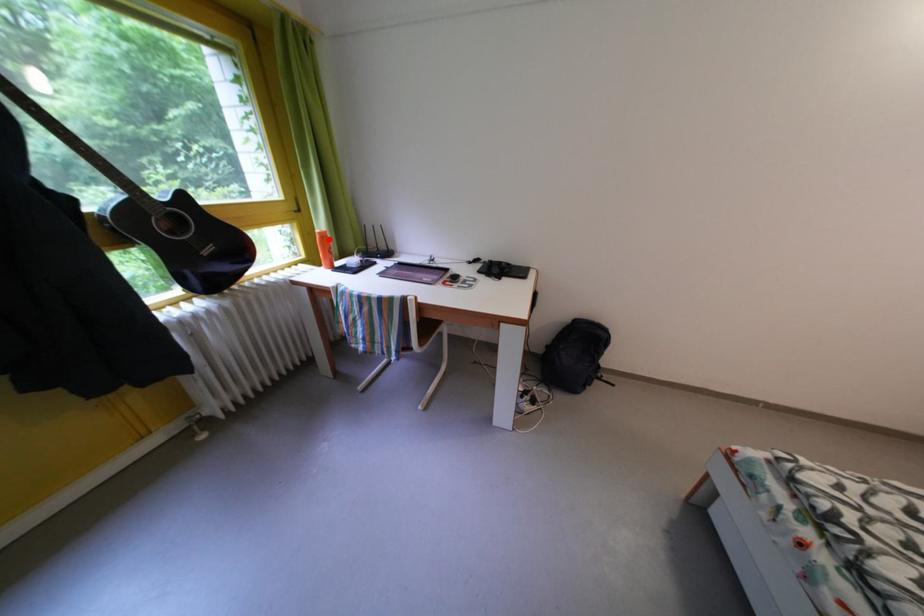
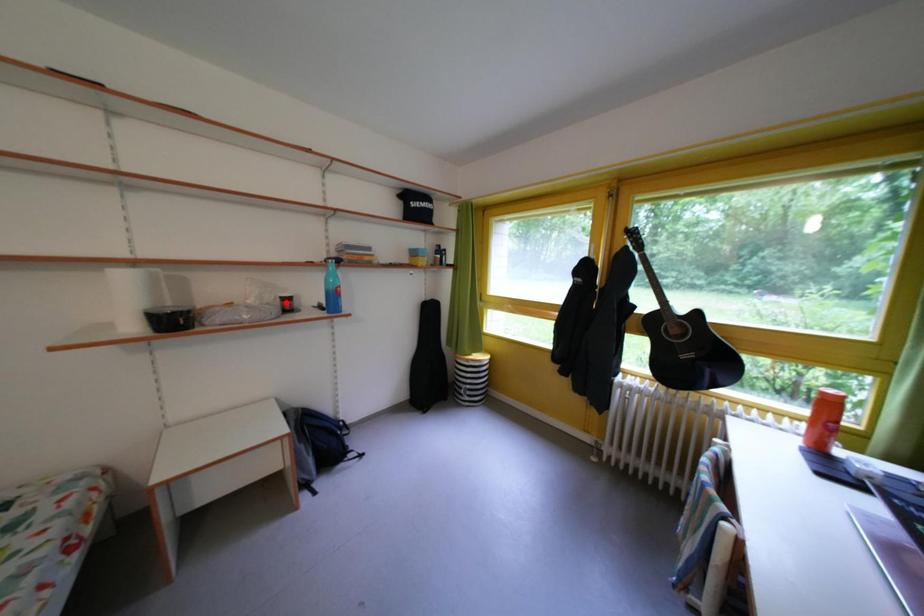
I am providing you with two images of the same scene from different viewpoints. A red point is marked on the first image and another point is marked on the second image. Is the red point in image1 aligned with the point shown in image2?

No